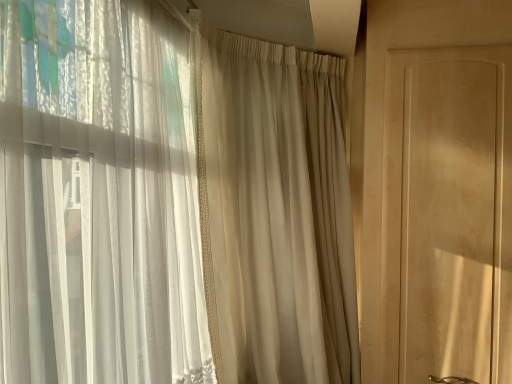
Question: From their relative heights in the image, would you say beige sheer curtain at center is taller or shorter than matte wood screen door at right?

Choices:
 (A) short
 (B) tall

Answer: (B)

Question: Considering the positions of beige sheer curtain at center and matte wood screen door at right in the image, is beige sheer curtain at center wider or thinner than matte wood screen door at right?

Choices:
 (A) wide
 (B) thin

Answer: (A)

Question: Does point (267, 120) appear closer or farther from the camera than point (403, 225)?

Choices:
 (A) closer
 (B) farther

Answer: (B)

Question: Is matte wood screen door at right inside or outside of beige sheer curtain at center?

Choices:
 (A) inside
 (B) outside

Answer: (B)

Question: Is matte wood screen door at right bigger or smaller than beige sheer curtain at center?

Choices:
 (A) small
 (B) big

Answer: (A)

Question: From their relative heights in the image, would you say matte wood screen door at right is taller or shorter than beige sheer curtain at center?

Choices:
 (A) short
 (B) tall

Answer: (A)

Question: From a real-world perspective, relative to beige sheer curtain at center, is matte wood screen door at right vertically above or below?

Choices:
 (A) below
 (B) above

Answer: (B)